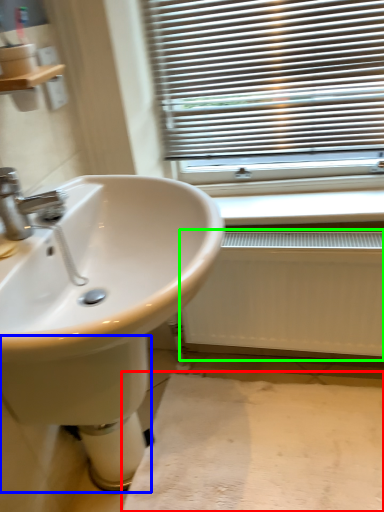
Question: Estimate the real-world distances between objects in this image. Which object is farther from plain (highlighted by a red box), bidet (highlighted by a blue box) or radiator (highlighted by a green box)?

Choices:
 (A) bidet
 (B) radiator

Answer: (A)